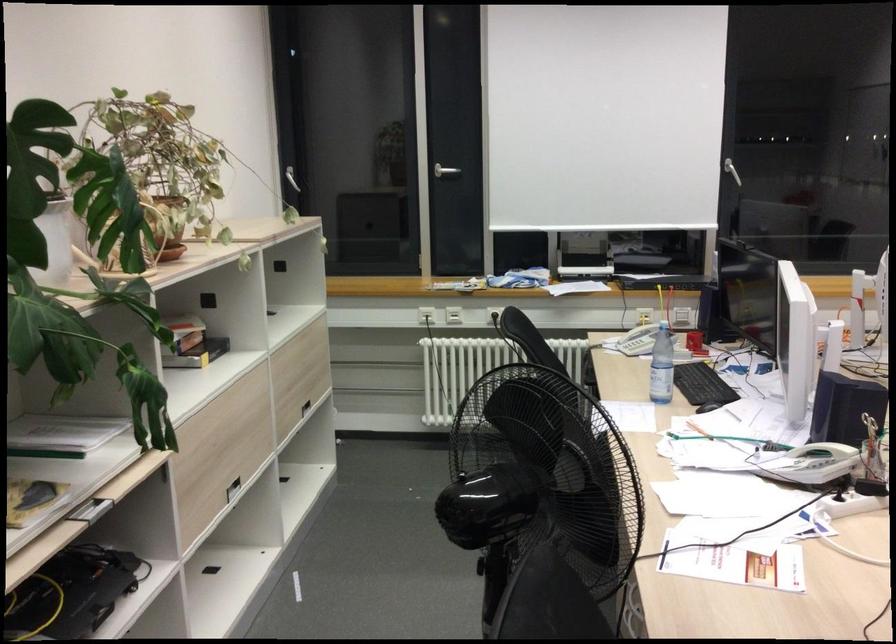
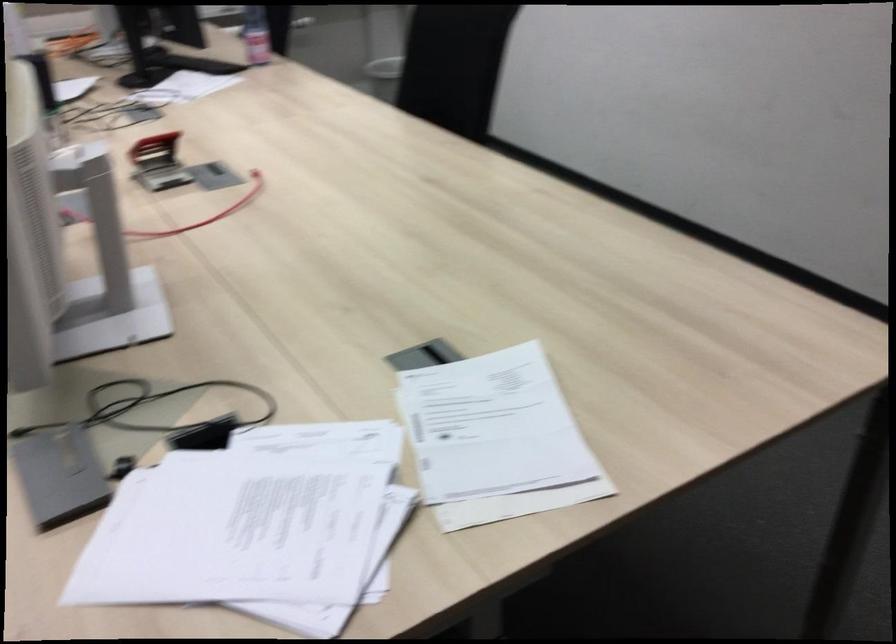
Based on the photo, the images are taken continuously from a first-person perspective. In which direction is your viewpoint rotating?

The rotation direction of the camera is right-down.